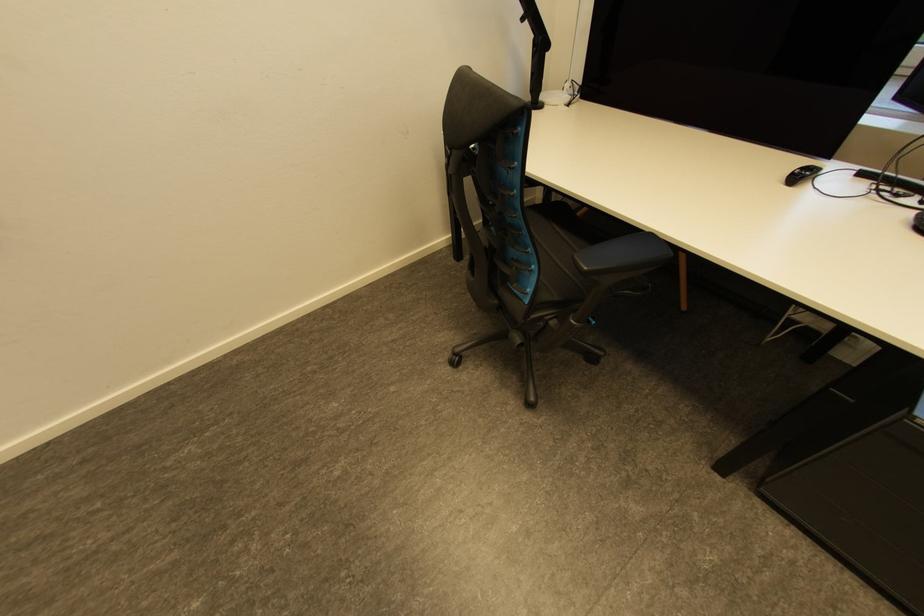
You are a GUI agent. You are given a task and a screenshot of the screen. Output one action in this format:
    pyautogui.click(x=<x>, y=<y>)
    Task: Click on the black chair sitting surface
    The image size is (924, 616).
    Given the screenshot: What is the action you would take?
    pyautogui.click(x=549, y=233)